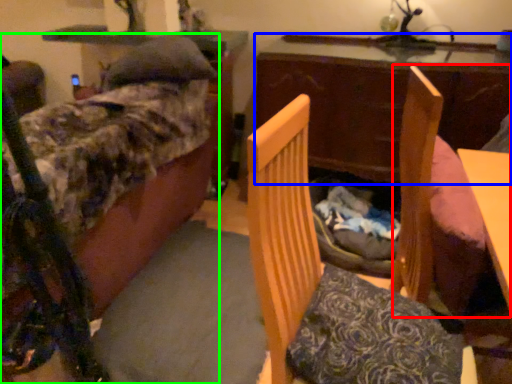
Question: Which object is positioned farthest from swivel chair (highlighted by a red box)? Select from table (highlighted by a blue box) and furniture (highlighted by a green box).

Choices:
 (A) table
 (B) furniture

Answer: (B)